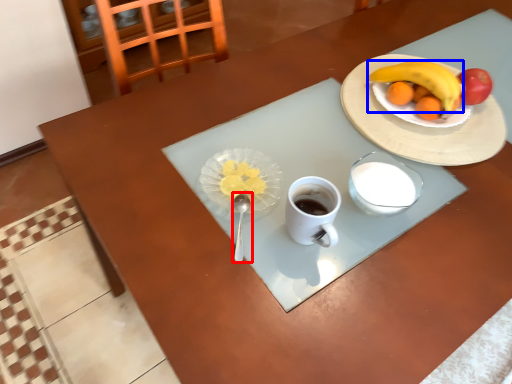
Question: Which point is further to the camera, utensil (highlighted by a red box) or banana (highlighted by a blue box)?

Choices:
 (A) utensil
 (B) banana

Answer: (B)